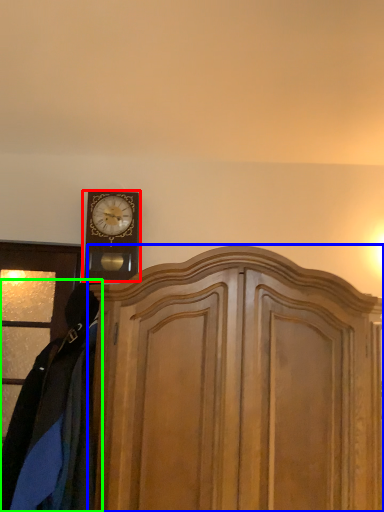
Question: Estimate the real-world distances between objects in this image. Which object is farther from wall clock (highlighted by a red box), dresser (highlighted by a blue box) or clothing (highlighted by a green box)?

Choices:
 (A) dresser
 (B) clothing

Answer: (A)